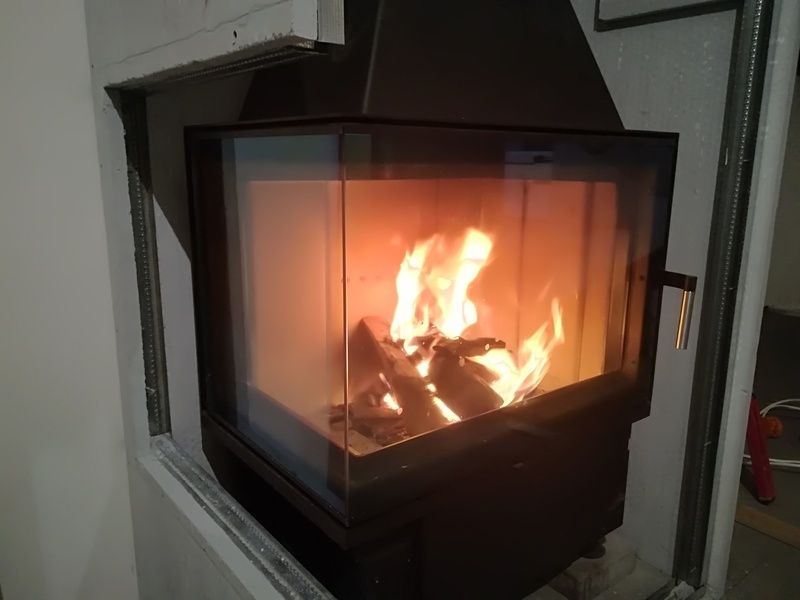
The width and height of the screenshot is (800, 600). In order to click on wall alcove in this screenshot , I will do `click(174, 234)`, `click(688, 79)`.